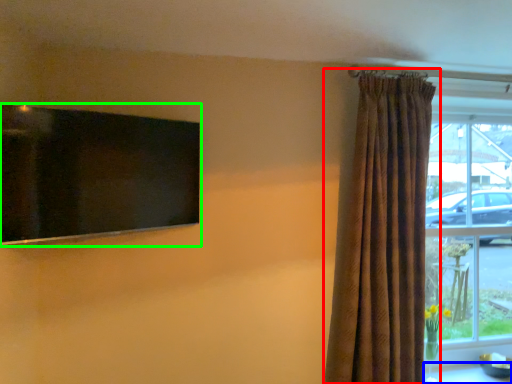
Question: Which is nearer to the curtain (highlighted by a red box)? table (highlighted by a blue box) or window screen (highlighted by a green box).

Choices:
 (A) table
 (B) window screen

Answer: (A)